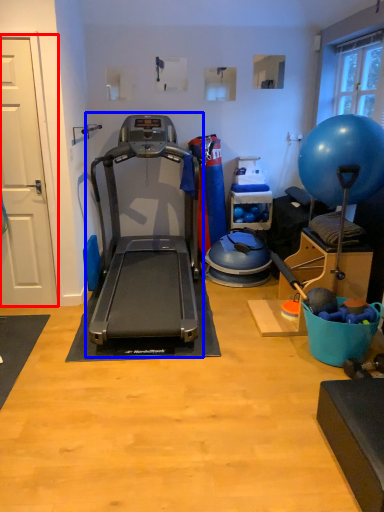
Question: Which point is further to the camera, door (highlighted by a red box) or treadmill (highlighted by a blue box)?

Choices:
 (A) door
 (B) treadmill

Answer: (A)